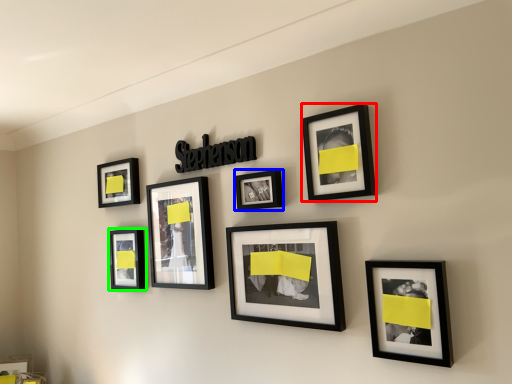
Question: Which is nearer to the picture frame (highlighted by a red box)? picture frame (highlighted by a blue box) or picture frame (highlighted by a green box).

Choices:
 (A) picture frame
 (B) picture frame

Answer: (A)